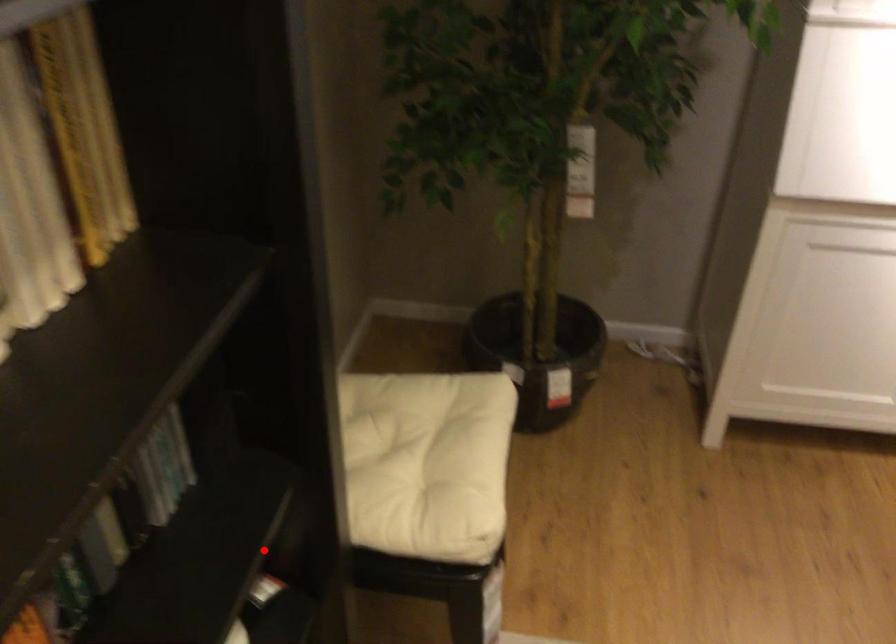
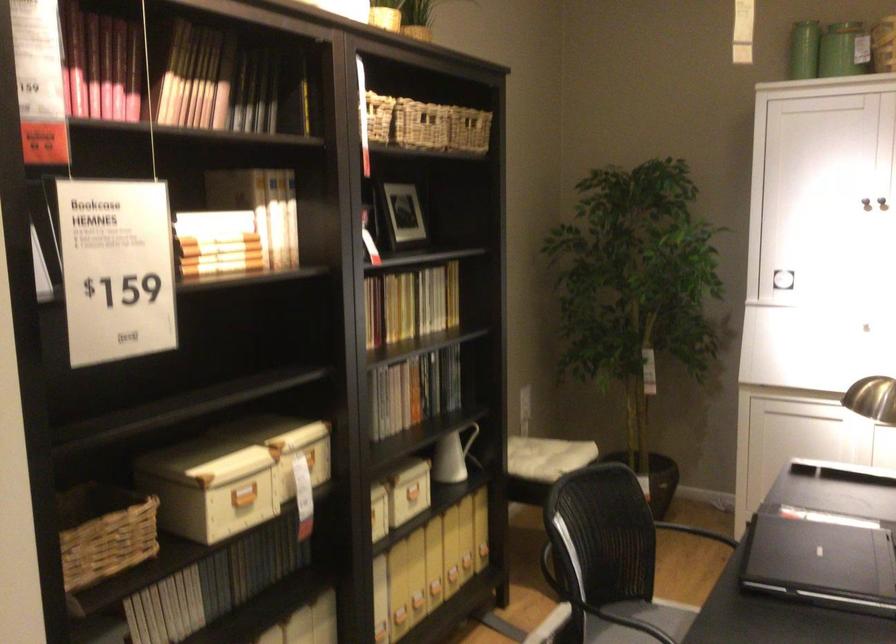
Question: I am providing you with two images of the same scene from different viewpoints. A red point is shown in image1. For the corresponding object point in image2, is it positioned nearer or farther from the camera?

Choices:
 (A) Nearer
 (B) Farther

Answer: (B)